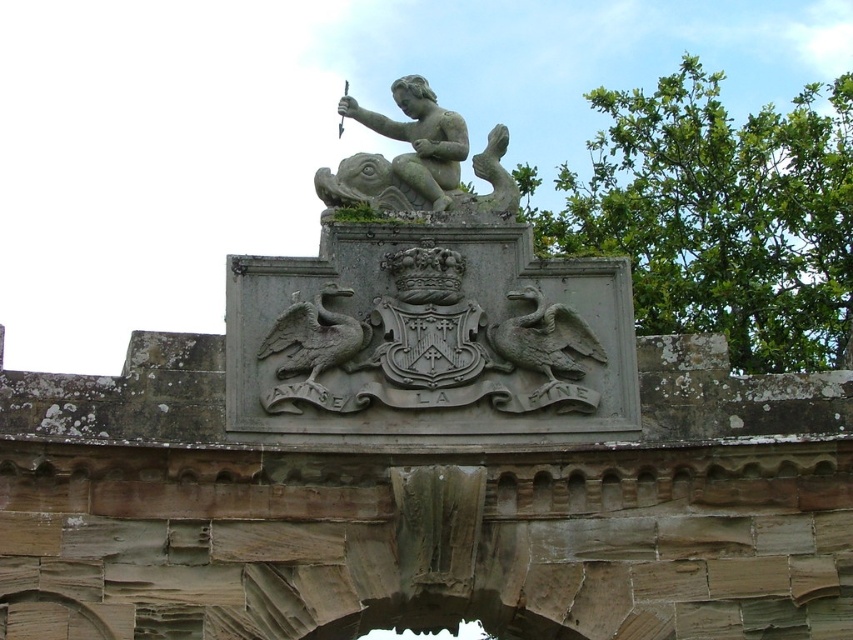
Looking at this image, who is positioned more to the left, gray stone cherub at center or gray stone griffin at center?

gray stone griffin at center

Is gray stone cherub at center smaller than gray stone griffin at center?

No, gray stone cherub at center is not smaller than gray stone griffin at center.

Between point (432, 164) and point (339, 326), which one is positioned in front?

Point (339, 326)

Where is `gray stone cherub at center`? gray stone cherub at center is located at coordinates (418, 160).

Who is higher up, gray stone cherub at center or carved stone duck at center?

gray stone cherub at center

Is point (473, 195) more distant than point (509, 296)?

Yes, point (473, 195) is farther from viewer.

Find the location of `gray stone cherub at center`. gray stone cherub at center is located at coordinates (418, 160).

Is point (563, 310) positioned behind point (287, 324)?

Yes, it is behind point (287, 324).

Find the location of a particular element. The height and width of the screenshot is (640, 853). carved stone duck at center is located at coordinates (544, 339).

What do you see at coordinates (544, 339) in the screenshot? This screenshot has width=853, height=640. I see `carved stone duck at center` at bounding box center [544, 339].

Find the location of a particular element. This screenshot has height=640, width=853. carved stone duck at center is located at coordinates (544, 339).